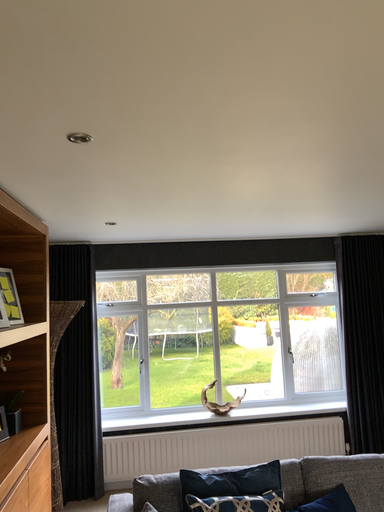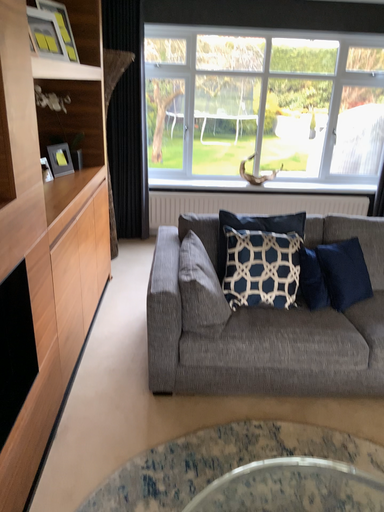
Question: Which way did the camera rotate in the video?

Choices:
 (A) rotated downward
 (B) rotated upward

Answer: (A)